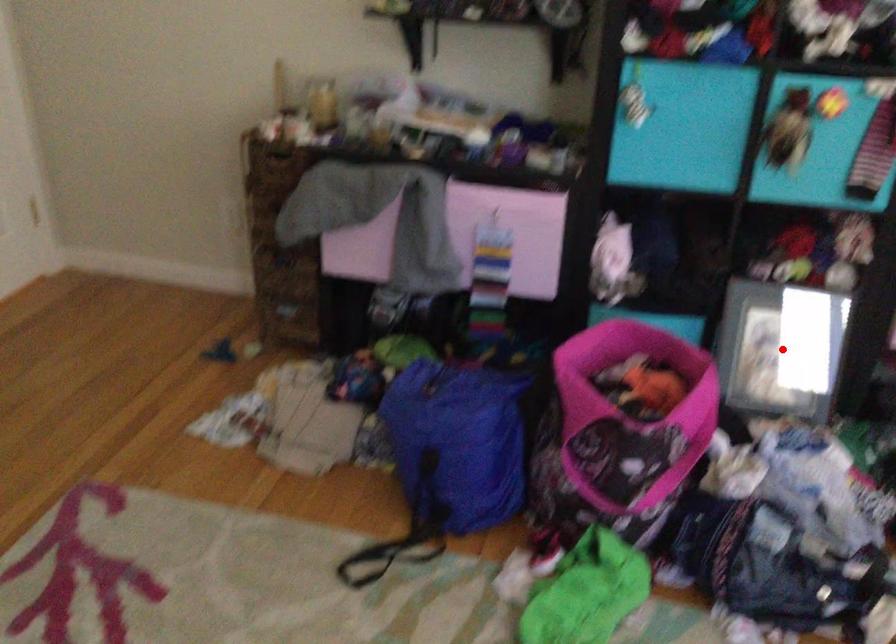
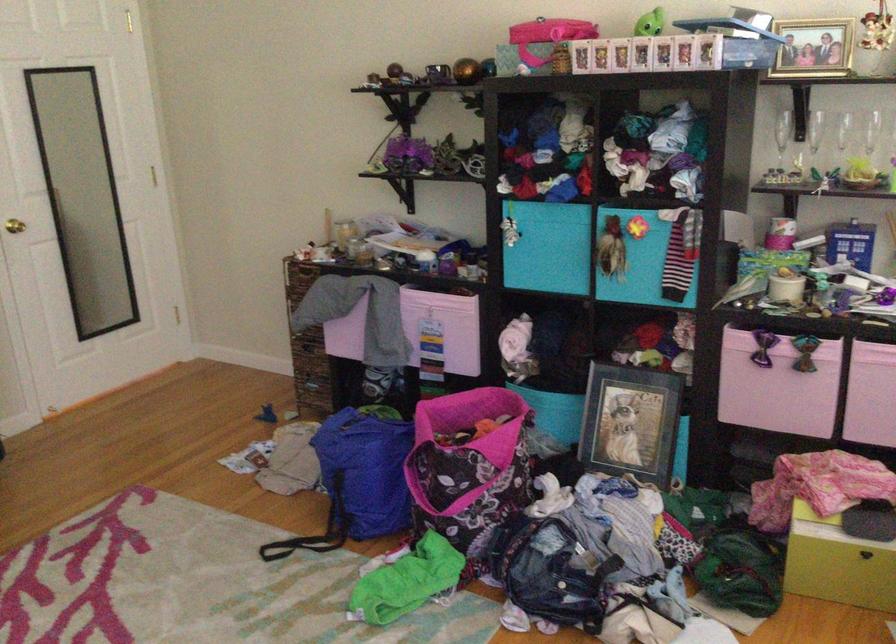
Question: A red point is marked in image1. In image2, is the corresponding 3D point closer to the camera or farther? Reply with the corresponding letter.

Choices:
 (A) The corresponding 3D point is closer.
 (B) The corresponding 3D point is farther.

Answer: (B)